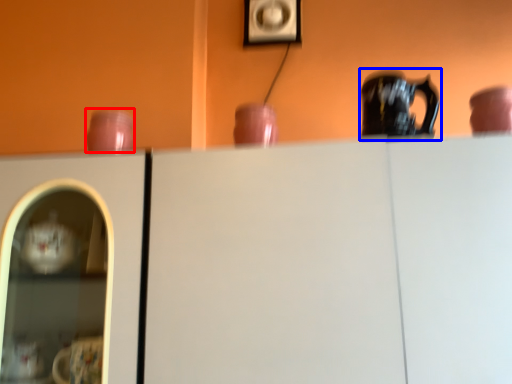
Question: Among these objects, which one is nearest to the camera, tableware (highlighted by a red box) or jug (highlighted by a blue box)?

Choices:
 (A) tableware
 (B) jug

Answer: (B)